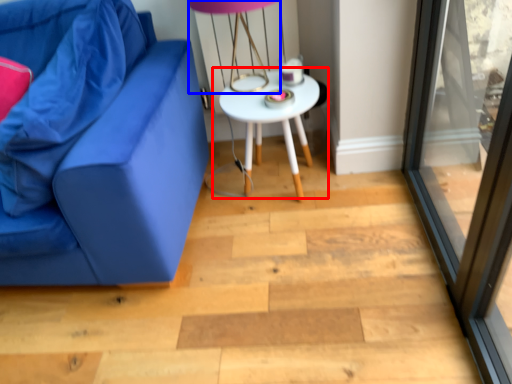
Question: Which point is closer to the camera, table (highlighted by a red box) or table lamp (highlighted by a blue box)?

Choices:
 (A) table
 (B) table lamp

Answer: (B)